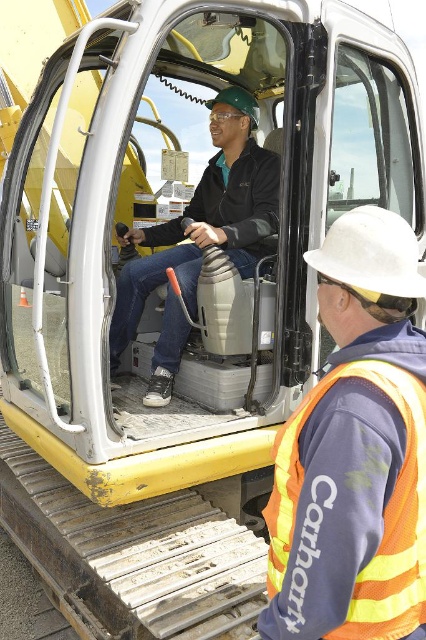
Question: Among these points, which one is nearest to the camera?

Choices:
 (A) (287, 556)
 (B) (175, 355)

Answer: (A)

Question: Which object is farther from the camera taking this photo?

Choices:
 (A) orange reflective safety vest at lower right
 (B) matte black jacket at center

Answer: (B)

Question: From the image, what is the correct spatial relationship of matte black jacket at center in relation to orange reflective safety vest at lower right?

Choices:
 (A) below
 (B) above

Answer: (B)

Question: Is matte black jacket at center smaller than orange reflective safety vest at lower right?

Choices:
 (A) yes
 (B) no

Answer: (B)

Question: Which point appears farthest from the camera in this image?

Choices:
 (A) (126, 292)
 (B) (385, 547)

Answer: (A)

Question: In this image, where is matte black jacket at center located relative to orange reflective safety vest at lower right?

Choices:
 (A) left
 (B) right

Answer: (A)